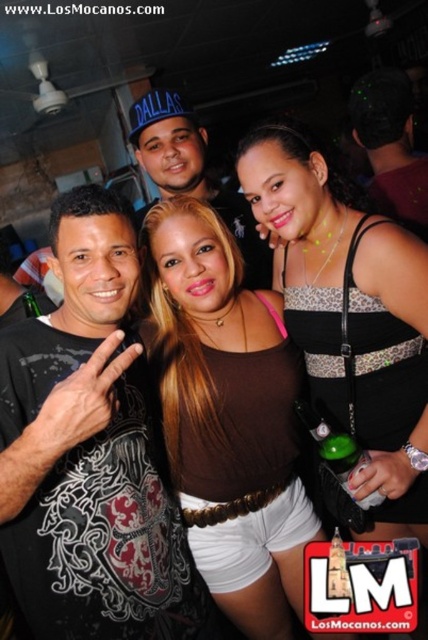
Question: Which point is closer to the camera?

Choices:
 (A) (267, 595)
 (B) (333, 298)
 (C) (91, 188)
 (D) (388, 148)

Answer: (C)

Question: Can you confirm if brown matte tank top at center is wider than leopard print tank top at center?

Choices:
 (A) yes
 (B) no

Answer: (A)

Question: Which point is closer to the camera?

Choices:
 (A) (154, 609)
 (B) (225, 604)
 (C) (315, 332)

Answer: (A)

Question: Can you confirm if leopard print tank top at center is smaller than matte black cap at upper center?

Choices:
 (A) no
 (B) yes

Answer: (A)

Question: Where is black printed t-shirt at center located in relation to brown matte tank top at center in the image?

Choices:
 (A) left
 (B) right

Answer: (A)

Question: Which object appears closest to the camera in this image?

Choices:
 (A) matte black cap at upper center
 (B) black printed t-shirt at center
 (C) brown matte tank top at center

Answer: (B)